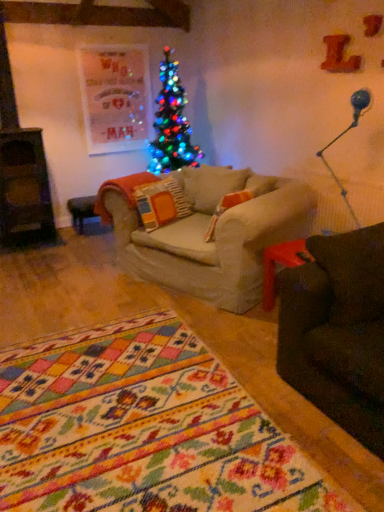
Question: Considering the relative sizes of blue glass lamp at upper right and knitted woolen pillow at center in the image provided, is blue glass lamp at upper right shorter than knitted woolen pillow at center?

Choices:
 (A) no
 (B) yes

Answer: (A)

Question: Is blue glass lamp at upper right thinner than knitted woolen pillow at center?

Choices:
 (A) yes
 (B) no

Answer: (A)

Question: Is blue glass lamp at upper right at the left side of knitted woolen pillow at center?

Choices:
 (A) yes
 (B) no

Answer: (B)

Question: Considering the relative positions of blue glass lamp at upper right and knitted woolen pillow at center in the image provided, is blue glass lamp at upper right to the right of knitted woolen pillow at center from the viewer's perspective?

Choices:
 (A) no
 (B) yes

Answer: (B)

Question: Is blue glass lamp at upper right with knitted woolen pillow at center?

Choices:
 (A) no
 (B) yes

Answer: (A)

Question: Is blue glass lamp at upper right wider than knitted woolen pillow at center?

Choices:
 (A) yes
 (B) no

Answer: (B)

Question: Considering the relative sizes of knitted woolen pillow at center and blue glass lamp at upper right in the image provided, is knitted woolen pillow at center taller than blue glass lamp at upper right?

Choices:
 (A) no
 (B) yes

Answer: (A)

Question: From the image's perspective, is knitted woolen pillow at center on top of blue glass lamp at upper right?

Choices:
 (A) no
 (B) yes

Answer: (A)

Question: Is knitted woolen pillow at center at the left side of blue glass lamp at upper right?

Choices:
 (A) no
 (B) yes

Answer: (B)

Question: Does knitted woolen pillow at center come in front of blue glass lamp at upper right?

Choices:
 (A) no
 (B) yes

Answer: (A)

Question: Considering the relative sizes of knitted woolen pillow at center and blue glass lamp at upper right in the image provided, is knitted woolen pillow at center smaller than blue glass lamp at upper right?

Choices:
 (A) yes
 (B) no

Answer: (A)

Question: Can you confirm if knitted woolen pillow at center is bigger than blue glass lamp at upper right?

Choices:
 (A) no
 (B) yes

Answer: (A)

Question: Choose the correct answer: Is blue glass lamp at upper right inside knitted woolen pillow at center or outside it?

Choices:
 (A) inside
 (B) outside

Answer: (B)